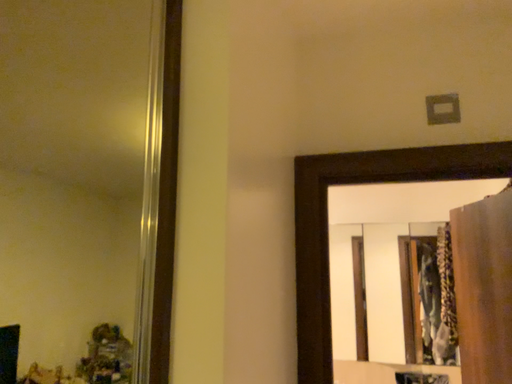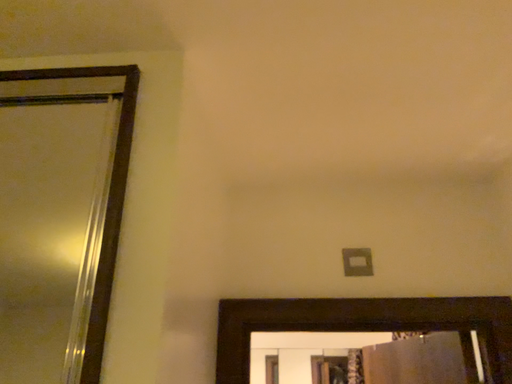
Question: How did the camera likely rotate when shooting the video?

Choices:
 (A) rotated downward
 (B) rotated upward

Answer: (B)